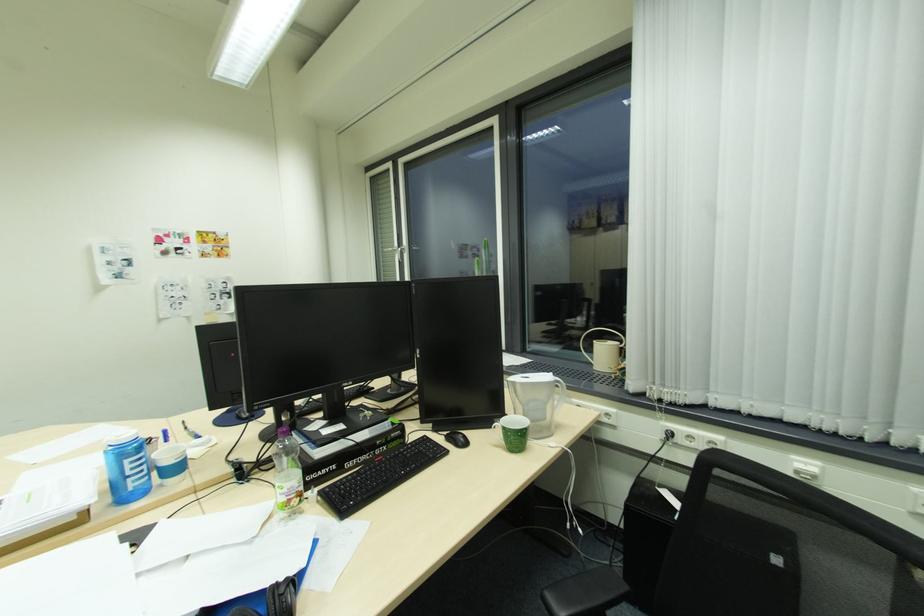
Locate an element on the screen. white light switch is located at coordinates (114, 262).